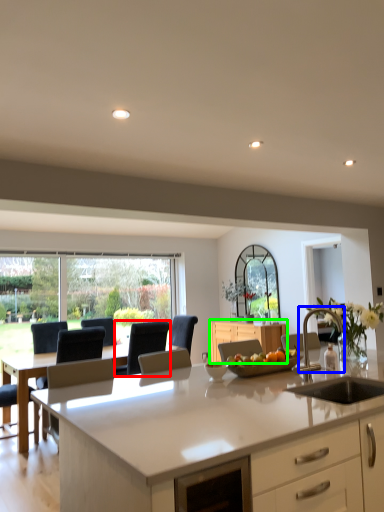
Question: Which object is positioned farthest from armchair (highlighted by a red box)? Select from armchair (highlighted by a blue box) and cabinetry (highlighted by a green box).

Choices:
 (A) armchair
 (B) cabinetry

Answer: (A)